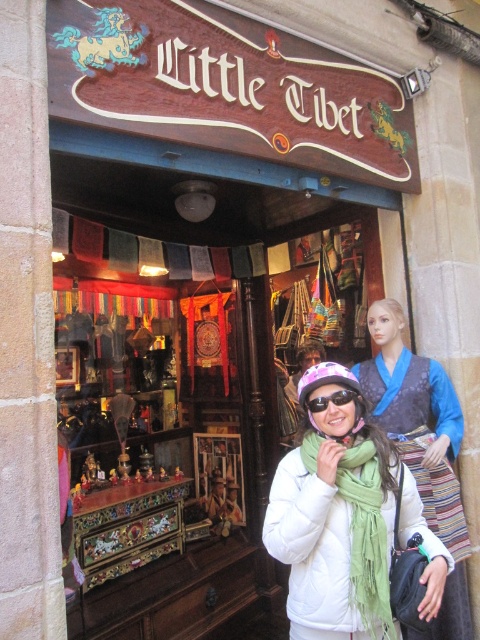
Question: Is white matte jacket at center smaller than matte purple goggles at center?

Choices:
 (A) yes
 (B) no

Answer: (B)

Question: Where is green fringed scarf at center located in relation to matte purple goggles at center in the image?

Choices:
 (A) right
 (B) left

Answer: (A)

Question: Considering the real-world distances, which object is farthest from the white matte jacket at center?

Choices:
 (A) green fringed scarf at center
 (B) matte purple goggles at center

Answer: (B)

Question: In this image, where is green fringed scarf at center located relative to matte purple goggles at center?

Choices:
 (A) above
 (B) below

Answer: (B)

Question: Which of the following is the closest to the observer?

Choices:
 (A) matte purple goggles at center
 (B) green fringed scarf at center
 (C) white matte jacket at center

Answer: (C)

Question: Which object is farther from the camera taking this photo?

Choices:
 (A) green fringed scarf at center
 (B) white matte jacket at center
 (C) matte purple goggles at center

Answer: (C)